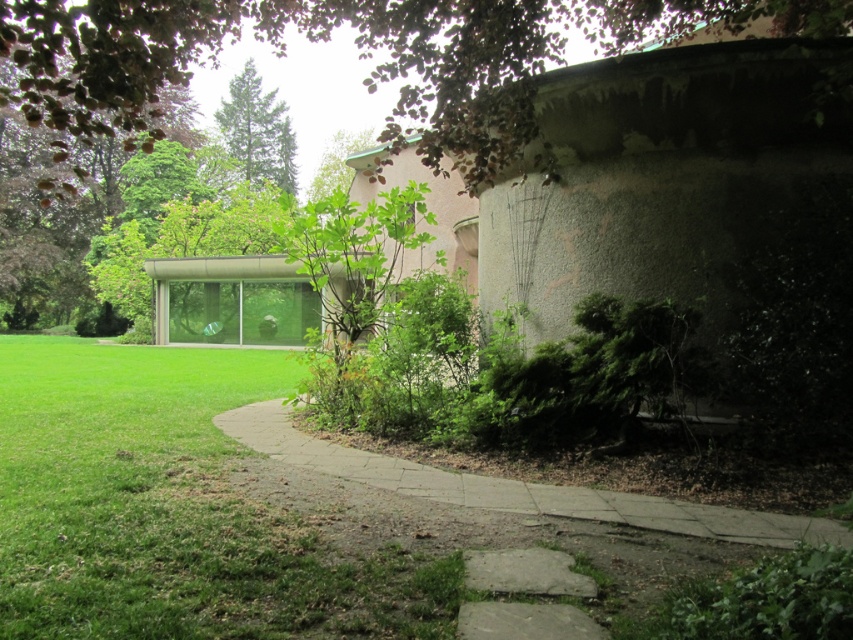
Does purple-leaved tree at upper left have a lesser height compared to smooth concrete path at center?

In fact, purple-leaved tree at upper left may be taller than smooth concrete path at center.

Does point (666, 0) come in front of point (479, 493)?

No, it is not.

Find the location of a particular element. purple-leaved tree at upper left is located at coordinates (358, 52).

Which is in front, point (79, 83) or point (257, 90)?

Positioned in front is point (79, 83).

Can you confirm if purple-leaved tree at upper left is thinner than green textured tree at upper center?

In fact, purple-leaved tree at upper left might be wider than green textured tree at upper center.

Measure the distance between purple-leaved tree at upper left and camera.

purple-leaved tree at upper left and camera are 3.79 meters apart.

Where is `purple-leaved tree at upper left`? This screenshot has height=640, width=853. purple-leaved tree at upper left is located at coordinates (358, 52).

Consider the image. Which is more to the left, smooth concrete path at center or green textured tree at upper center?

green textured tree at upper center is more to the left.

Can you confirm if smooth concrete path at center is thinner than green textured tree at upper center?

Indeed, smooth concrete path at center has a lesser width compared to green textured tree at upper center.

Locate an element on the screen. Image resolution: width=853 pixels, height=640 pixels. smooth concrete path at center is located at coordinates (515, 486).